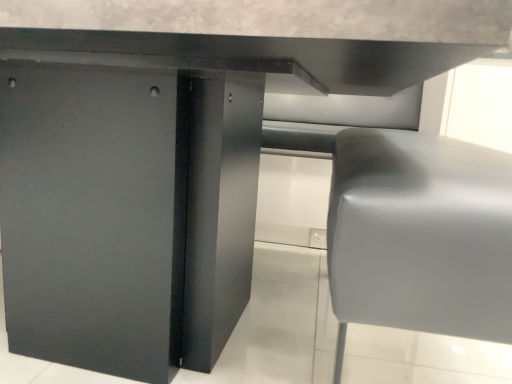
What do you see at coordinates (420, 235) in the screenshot?
I see `satin grey leather chair at lower right` at bounding box center [420, 235].

Find the location of a particular element. The height and width of the screenshot is (384, 512). satin grey leather chair at lower right is located at coordinates (420, 235).

What is the approximate width of satin grey leather chair at lower right?

It is 17.58 inches.

Find the location of a particular element. This screenshot has width=512, height=384. satin grey leather chair at lower right is located at coordinates (420, 235).